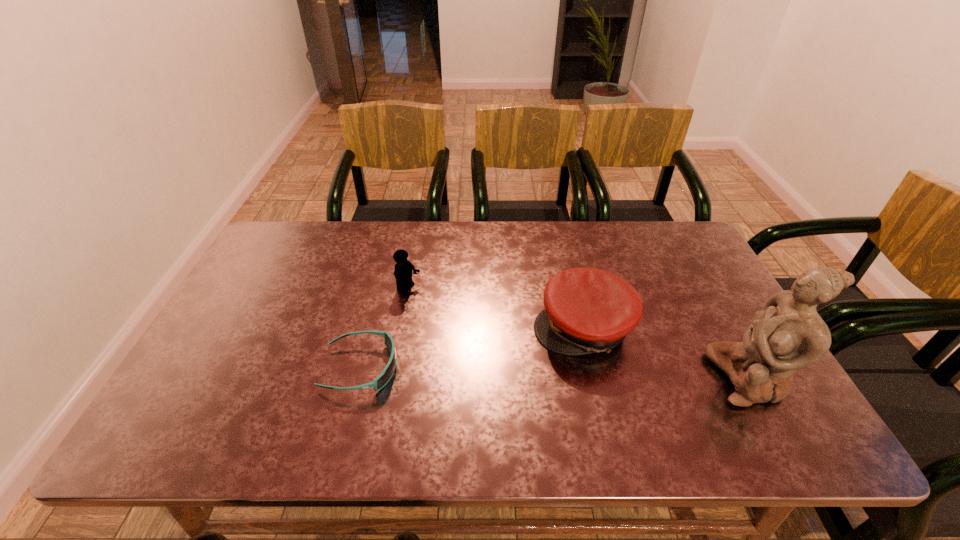
Find the location of a particular element. vacant spot on the desktop that is between the shortest object and the figurine and is positioned on the front-facing side of the Lego is located at coordinates (561, 373).

This screenshot has height=540, width=960. I want to click on vacant space on the desktop that is between the shortest object and the tallest object and is positioned on the front of the third object from left to right with an emblem, so click(495, 372).